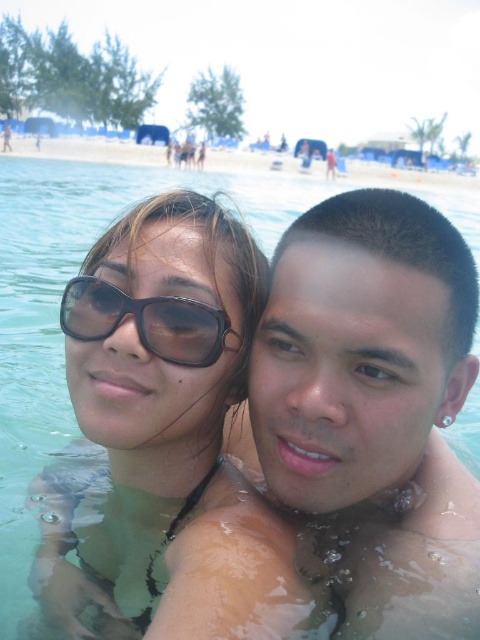
Question: Which point appears closest to the camera in this image?

Choices:
 (A) (456, 180)
 (B) (169, 392)

Answer: (B)

Question: Estimate the real-world distances between objects in this image. Which object is closer to the matte black sunglasses at center?

Choices:
 (A) black plastic sunglasses at center
 (B) clear sand at upper center
 (C) shiny skin at center

Answer: (A)

Question: Can you confirm if matte black sunglasses at center is positioned above black plastic sunglasses at center?

Choices:
 (A) yes
 (B) no

Answer: (B)

Question: Is matte black sunglasses at center above clear sand at upper center?

Choices:
 (A) no
 (B) yes

Answer: (A)

Question: Which point is farther from the camera taking this photo?

Choices:
 (A) (85, 284)
 (B) (94, 344)

Answer: (B)

Question: In this image, where is black plastic sunglasses at center located relative to clear sand at upper center?

Choices:
 (A) right
 (B) left

Answer: (B)